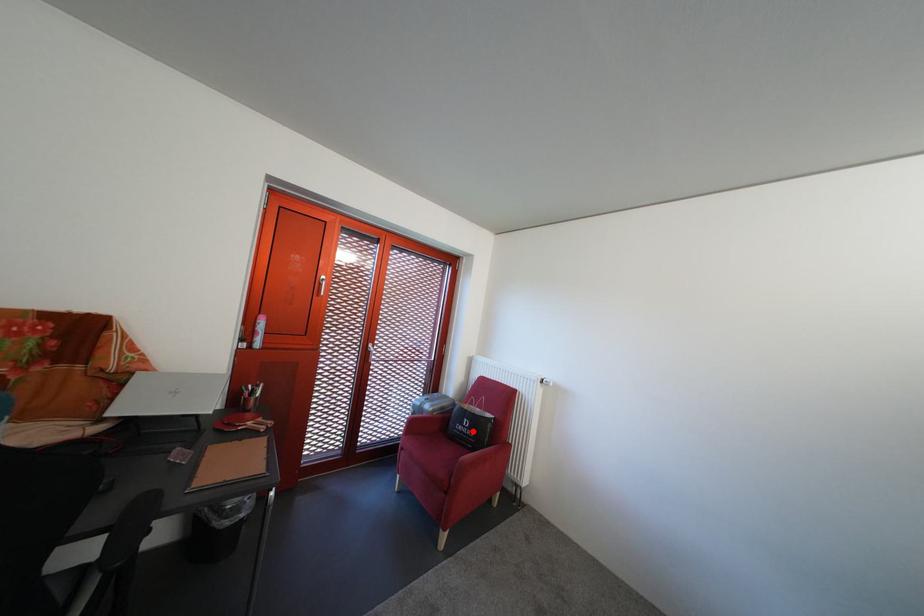
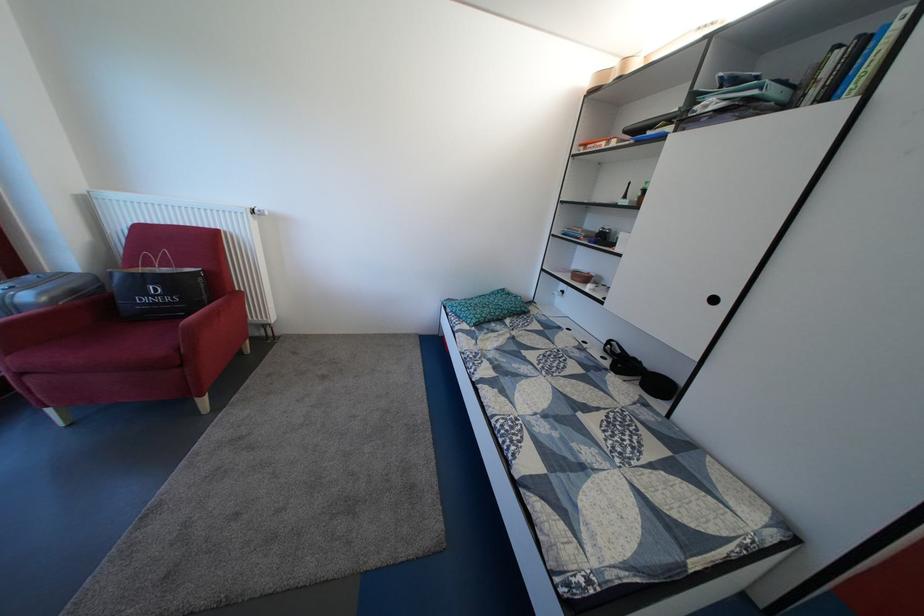
Find the pixel in the second image that matches the highlighted location in the first image.

(159, 302)